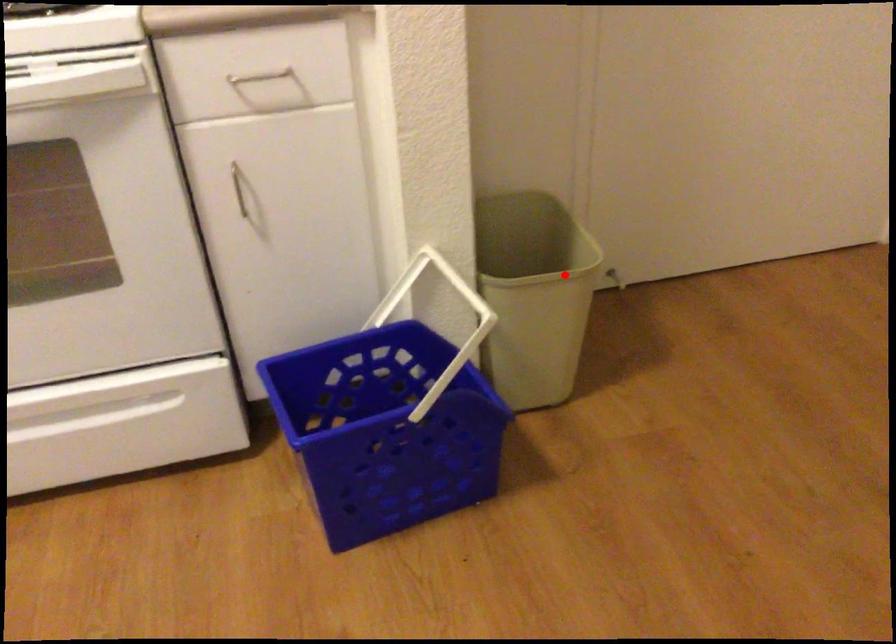
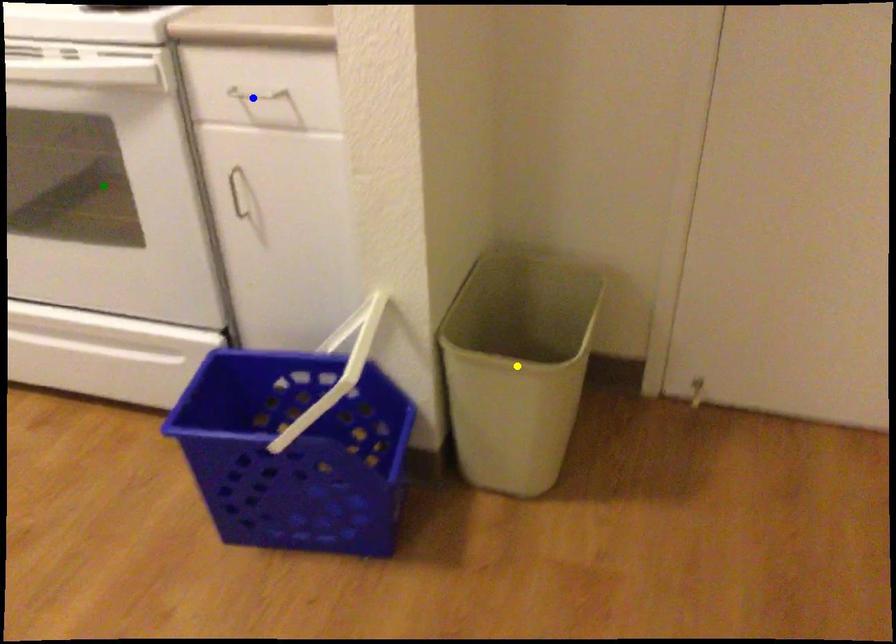
Question: I am providing you with two images of the same scene from different viewpoints. A red point is marked on the first image. You are given multiple points on the second image. Which spot in image 2 lines up with the point in image 1?

Choices:
 (A) green point
 (B) blue point
 (C) yellow point

Answer: (C)